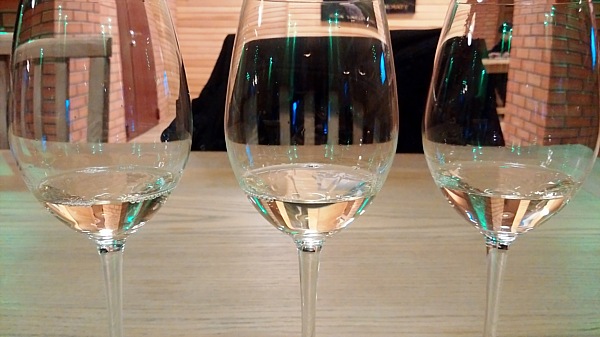
Where is `table`? The width and height of the screenshot is (600, 337). table is located at coordinates (239, 283).